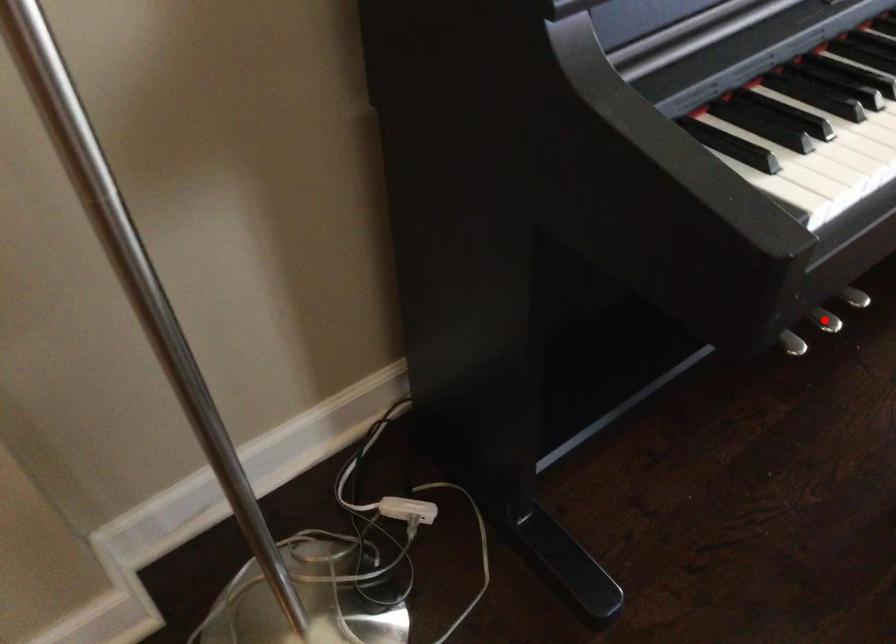
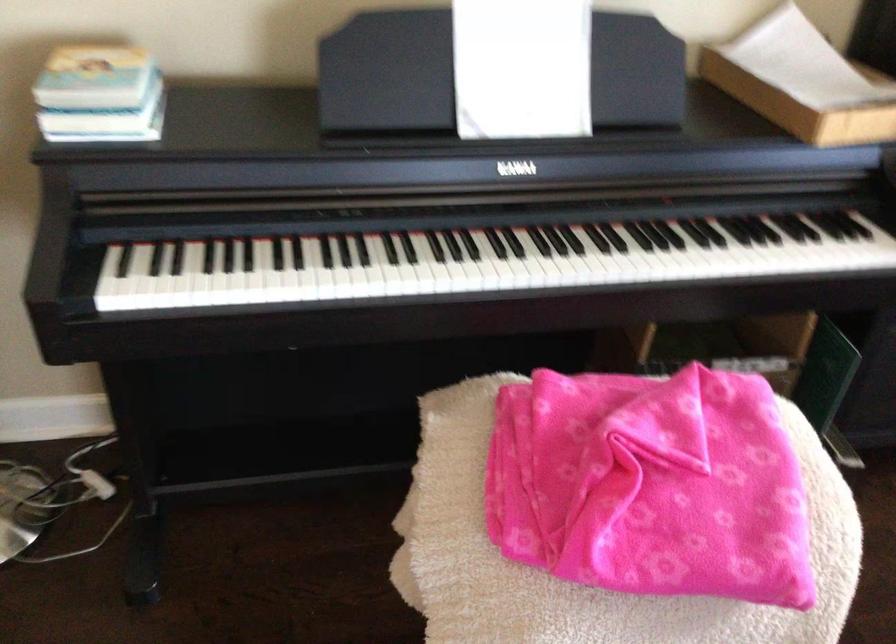
Question: I am providing you with two images of the same scene from different viewpoints. A red point is marked on the first image. Can you still see the location of the red point in image 2?

Choices:
 (A) Yes
 (B) No

Answer: (B)